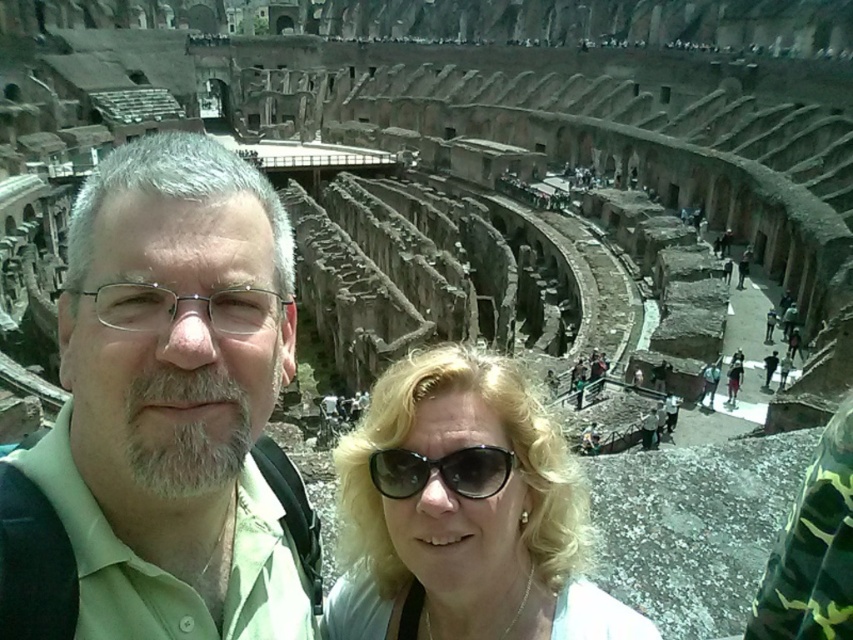
Question: Observing the image, what is the correct spatial positioning of green matte shirt at center in reference to blonde hair at center?

Choices:
 (A) right
 (B) left

Answer: (B)

Question: Can you confirm if green matte shirt at center is positioned below black plastic sunglasses at center?

Choices:
 (A) no
 (B) yes

Answer: (A)

Question: Is green matte shirt at center to the left of blonde hair at center from the viewer's perspective?

Choices:
 (A) yes
 (B) no

Answer: (A)

Question: Which point is farther to the camera?

Choices:
 (A) blonde hair at center
 (B) green matte shirt at center
 (C) black plastic sunglasses at center

Answer: (C)

Question: Which of the following is the farthest from the observer?

Choices:
 (A) (380, 467)
 (B) (374, 438)

Answer: (B)

Question: Which point is farther from the camera taking this photo?

Choices:
 (A) (276, 563)
 (B) (488, 468)
 (C) (335, 588)

Answer: (C)